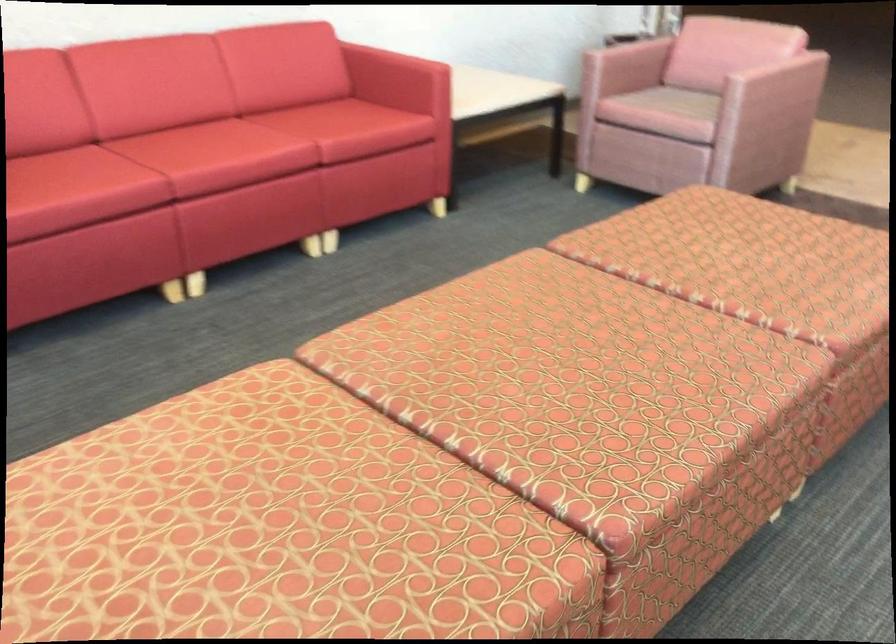
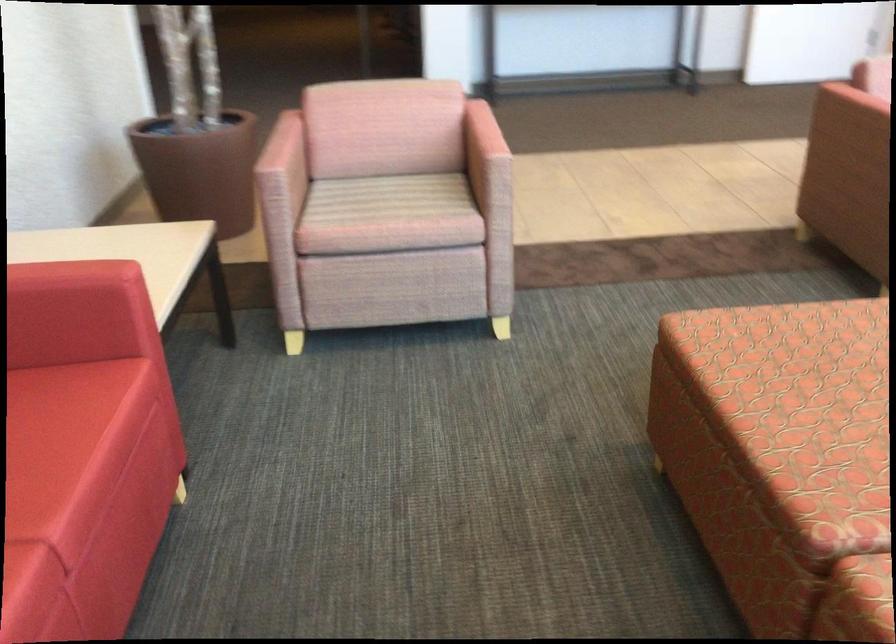
The point at (676, 98) is marked in the first image. Where is the corresponding point in the second image?

(389, 198)